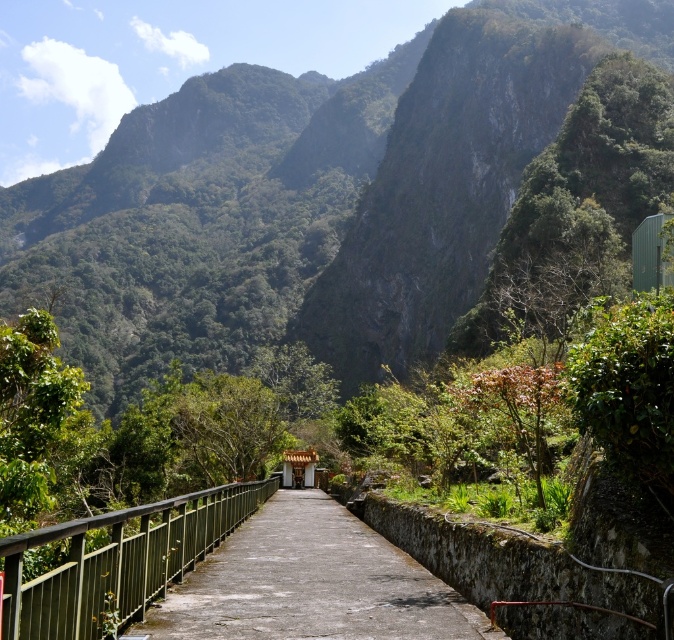
Image resolution: width=674 pixels, height=640 pixels. I want to click on green leafy mountain at upper center, so click(x=301, y=202).

Which is more to the right, green leafy mountain at upper center or concrete at center?

Positioned to the right is concrete at center.

In order to click on green leafy mountain at upper center in this screenshot , I will do `click(301, 202)`.

Who is more distant from viewer, (328, 214) or (185, 524)?

Positioned behind is point (328, 214).

Is green leafy mountain at upper center to the right of green metal railing at center from the viewer's perspective?

No, green leafy mountain at upper center is not to the right of green metal railing at center.

Is point (295, 128) less distant than point (220, 488)?

No, (295, 128) is further to viewer.

I want to click on green leafy mountain at upper center, so click(x=301, y=202).

Between concrete at center and green metal railing at center, which one has less height?

Standing shorter between the two is concrete at center.

Which is behind, point (404, 632) or point (90, 586)?

The point (404, 632) is more distant.

Identify the location of concrete at center. The image size is (674, 640). (309, 582).